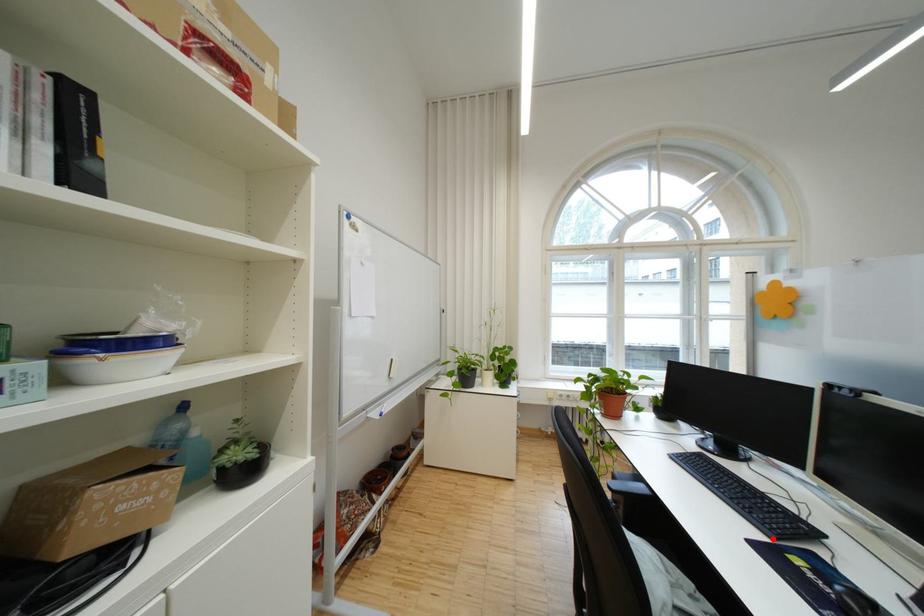
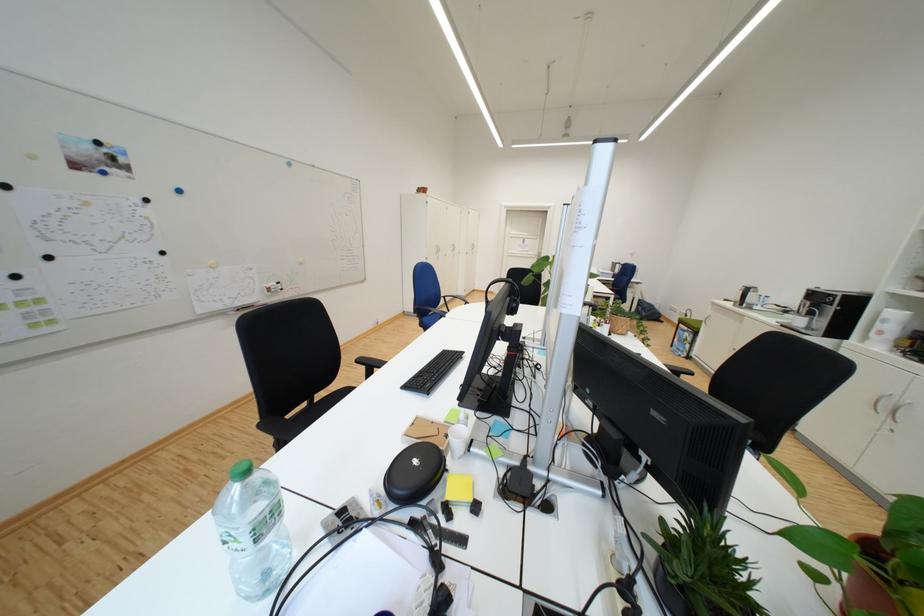
Question: I am providing you with two images of the same scene from different viewpoints. A red point is marked on the first image. At the location where the point appears in image 1, is it still visible in image 2?

Choices:
 (A) Yes
 (B) No

Answer: (B)